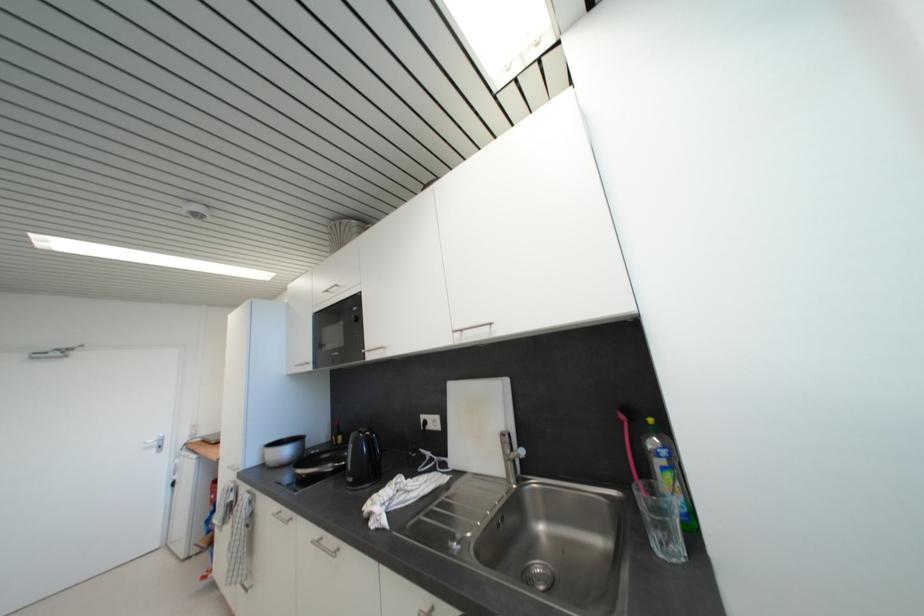
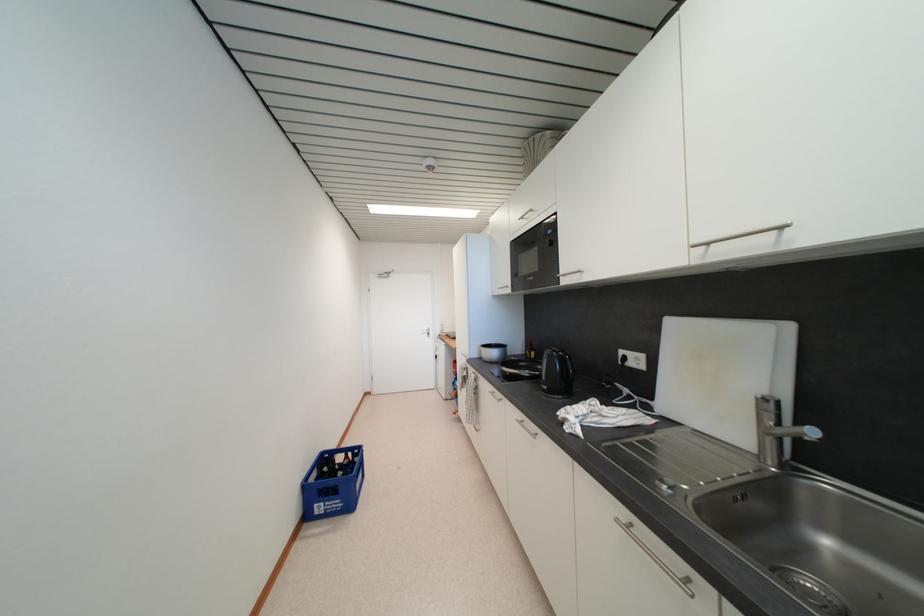
Question: The first image is from the beginning of the video and the second image is from the end. How did the camera likely rotate when shooting the video?

Choices:
 (A) Left
 (B) Right
 (C) Up
 (D) Down

Answer: (A)